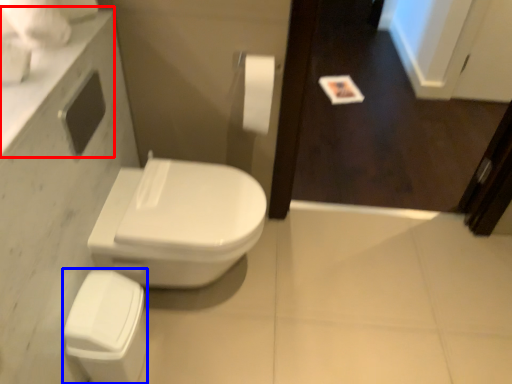
Question: Which object is closer to the camera taking this photo, counter top (highlighted by a red box) or porcelain (highlighted by a blue box)?

Choices:
 (A) counter top
 (B) porcelain

Answer: (A)